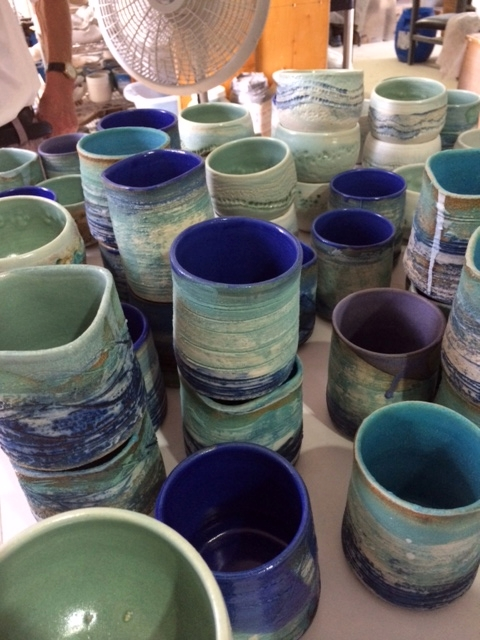
The width and height of the screenshot is (480, 640). Find the location of `light green cups`. light green cups is located at coordinates (112, 570), (47, 313), (30, 225), (11, 156), (209, 109), (254, 150), (415, 90).